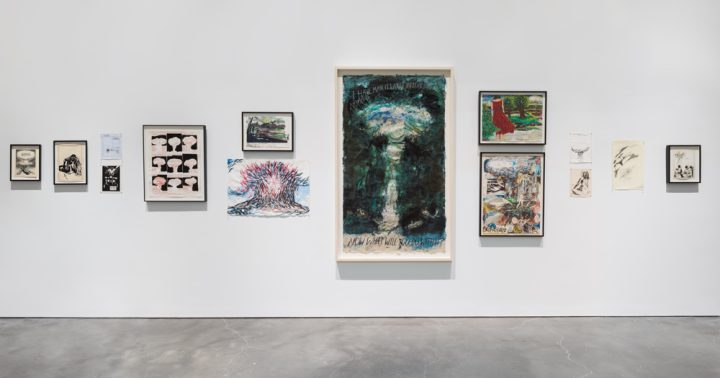
Find the location of `wall`. wall is located at coordinates (571, 84).